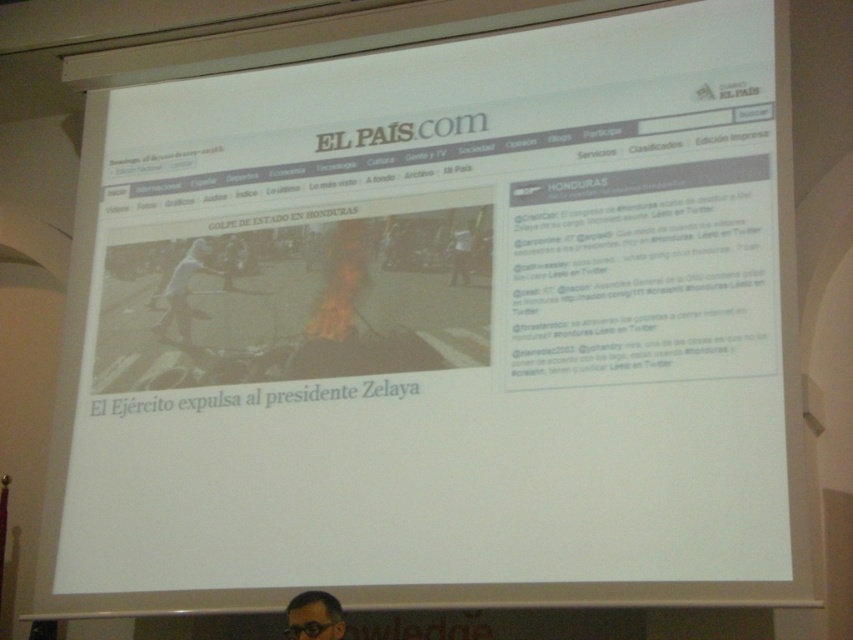
You are an attendee at a conference lecture. You notice two items at the bottom of the slide displayed on the screen. One is matte black glasses at lower center and the other is black plastic goggles at lower center. If you want to touch both items, which one would you reach first?

The matte black glasses at lower center is closer to you than the black plastic goggles at lower center, so you would reach the matte black glasses at lower center first.

You are a presenter standing in front of the screen showing the EL PAIS.com slide. You want to draw attention to two specific points on the slide. The first point is at coordinate point (320, 592) and the second is at point (302, 628). When you point to the first point, will your hand be closer to the screen or further away compared to when you point to the second point?

Point (320, 592) is behind point (302, 628). Therefore, when pointing to the first point, your hand will be further away from the screen compared to pointing to the second point.